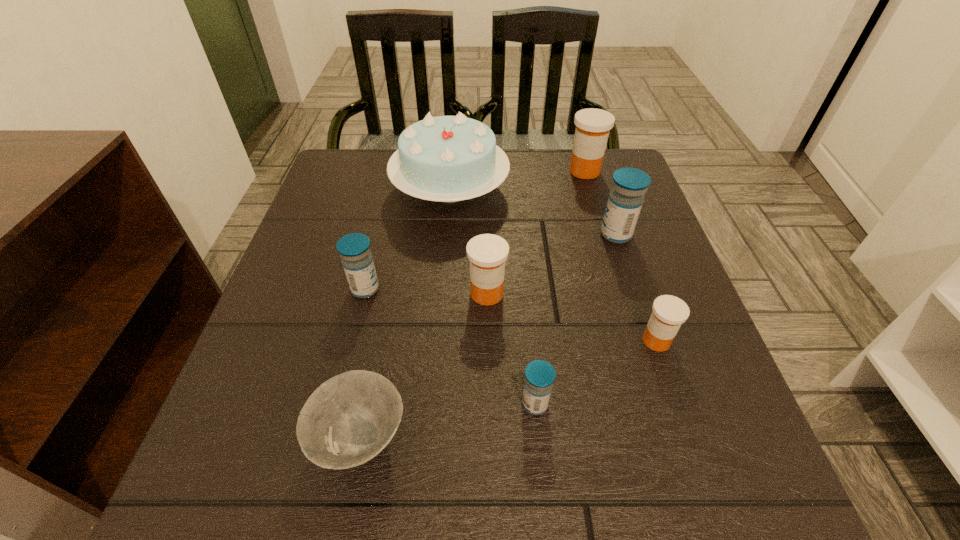
Identify which object is the fifth nearest to the second farthest blue medicine. Please provide its 2D coordinates. Your answer should be formatted as a tuple, i.e. [(x, y)], where the tuple contains the x and y coordinates of a point satisfying the conditions above.

[(626, 198)]

Choose which medicine is the nearest neighbor to the shortest object. Please provide its 2D coordinates. Your answer should be formatted as a tuple, i.e. [(x, y)], where the tuple contains the x and y coordinates of a point satisfying the conditions above.

[(539, 375)]

This screenshot has height=540, width=960. I want to click on the second closest medicine to the second farthest blue medicine, so click(539, 375).

Identify which orange medicine is the closest to the fourth medicine from right to left. Please provide its 2D coordinates. Your answer should be formatted as a tuple, i.e. [(x, y)], where the tuple contains the x and y coordinates of a point satisfying the conditions above.

[(487, 253)]

Locate an element on the screen. The height and width of the screenshot is (540, 960). orange medicine object that ranks as the closest to the leftmost orange medicine is located at coordinates (669, 312).

At what (x,y) coordinates should I click in order to perform the action: click on the second closest blue medicine to the nearest orange medicine. Please return your answer as a coordinate pair (x, y). The width and height of the screenshot is (960, 540). Looking at the image, I should click on (626, 198).

Find the location of a particular element. the second closest blue medicine to the farthest blue medicine is located at coordinates (354, 249).

This screenshot has width=960, height=540. I want to click on free space that satisfies the following two spatial constraints: 1. on the label of the farthest medicine; 2. on the front side of the nearest blue medicine, so click(654, 404).

You are a GUI agent. You are given a task and a screenshot of the screen. Output one action in this format:
    pyautogui.click(x=<x>, y=<y>)
    Task: Click on the vacant space that satisfies the following two spatial constraints: 1. on the label of the nearest blue medicine; 2. on the left side of the second biggest orange medicine
    
    Given the screenshot: What is the action you would take?
    pyautogui.click(x=489, y=404)